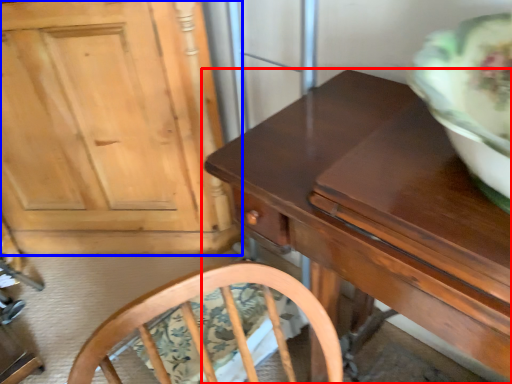
Question: Which object is further to the camera taking this photo, table (highlighted by a red box) or cabinetry (highlighted by a blue box)?

Choices:
 (A) table
 (B) cabinetry

Answer: (B)